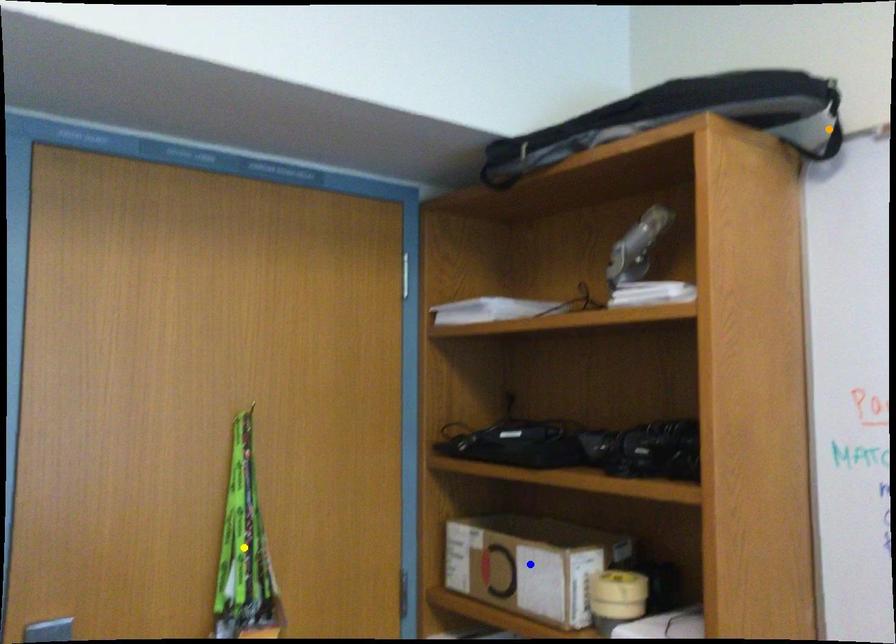
Order these from farthest to nearest:
orange point | blue point | yellow point

blue point, yellow point, orange point